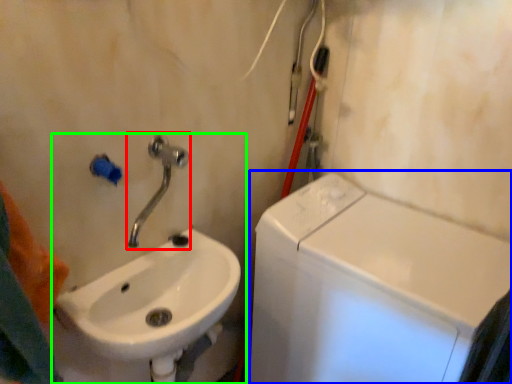
Question: Considering the real-world distances, which object is farthest from tap (highlighted by a red box)? washing machine (highlighted by a blue box) or sink (highlighted by a green box)?

Choices:
 (A) washing machine
 (B) sink

Answer: (A)